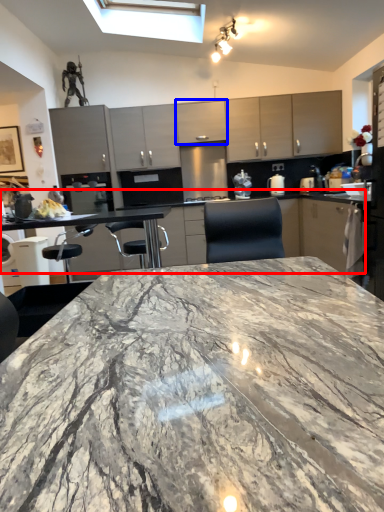
Question: Which point is further to the camera, counter top (highlighted by a red box) or cabinetry (highlighted by a blue box)?

Choices:
 (A) counter top
 (B) cabinetry

Answer: (B)